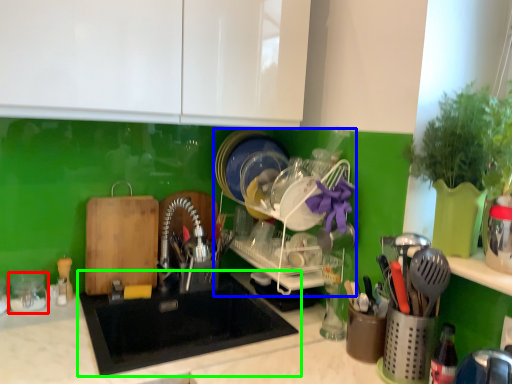
Question: Which object is positioned closest to tableware (highlighted by a red box)? Select from dish washer (highlighted by a blue box) and sink (highlighted by a green box).

Choices:
 (A) dish washer
 (B) sink

Answer: (B)